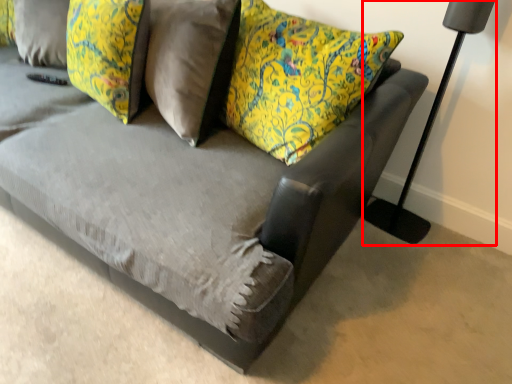
Question: From the image's perspective, what is the correct spatial positioning of table lamp (annotated by the red box) in reference to pillow?

Choices:
 (A) below
 (B) above

Answer: (A)